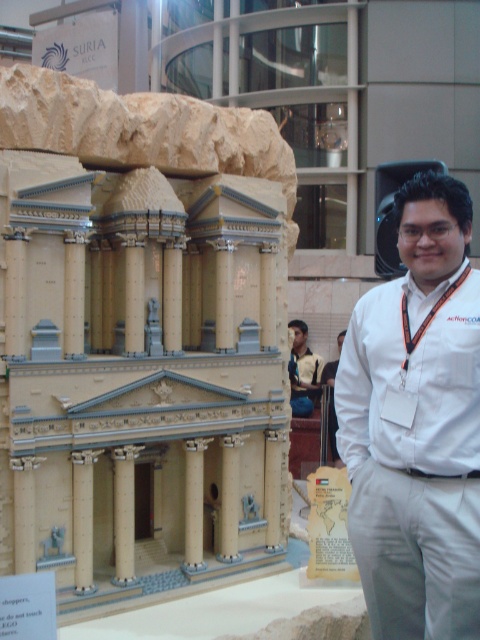
You are standing in front of the architectural model and notice the beige concrete column at center and the white shirt at center. From your perspective, which object is positioned to the left?

The beige concrete column at center is to the left of the white shirt at center.

You are an architect visiting the exhibition and need to measure the distance between the two central columns in the model. According to the model, how far apart are the beige concrete column at center and the beige wood column at center?

The beige concrete column at center and the beige wood column at center are 1.96 meters apart from each other.